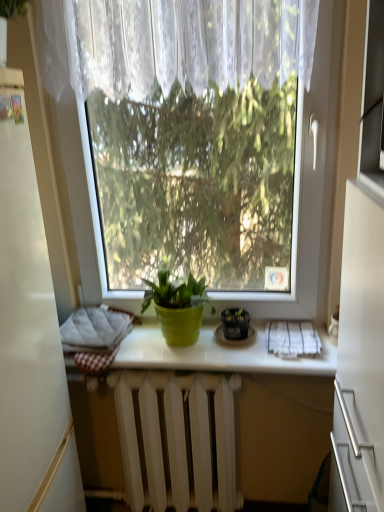
Locate an element on the screen. free location above white textured cloth at lower right (from a real-world perspective) is located at coordinates (298, 335).